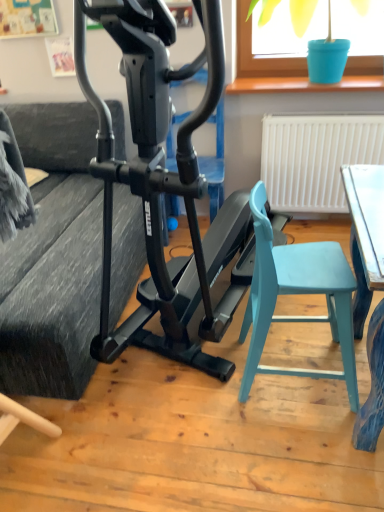
Question: Is black matte stationary bicycle at center smaller than textured gray couch at left?

Choices:
 (A) yes
 (B) no

Answer: (A)

Question: Is black matte stationary bicycle at center bigger than textured gray couch at left?

Choices:
 (A) no
 (B) yes

Answer: (A)

Question: Is black matte stationary bicycle at center not inside textured gray couch at left?

Choices:
 (A) yes
 (B) no

Answer: (A)

Question: Is black matte stationary bicycle at center shorter than textured gray couch at left?

Choices:
 (A) no
 (B) yes

Answer: (A)

Question: Is the depth of black matte stationary bicycle at center less than that of textured gray couch at left?

Choices:
 (A) yes
 (B) no

Answer: (A)

Question: Does black matte stationary bicycle at center touch textured gray couch at left?

Choices:
 (A) yes
 (B) no

Answer: (B)

Question: Can you see blue plastic bucket at upper right touching black matte stationary bicycle at center?

Choices:
 (A) no
 (B) yes

Answer: (A)

Question: Is blue plastic bucket at upper right at the right side of black matte stationary bicycle at center?

Choices:
 (A) no
 (B) yes

Answer: (B)

Question: Is blue plastic bucket at upper right facing away from black matte stationary bicycle at center?

Choices:
 (A) no
 (B) yes

Answer: (A)

Question: Considering the relative sizes of blue plastic bucket at upper right and black matte stationary bicycle at center in the image provided, is blue plastic bucket at upper right shorter than black matte stationary bicycle at center?

Choices:
 (A) no
 (B) yes

Answer: (B)

Question: From the image's perspective, does blue plastic bucket at upper right appear lower than black matte stationary bicycle at center?

Choices:
 (A) no
 (B) yes

Answer: (A)

Question: Can you confirm if blue plastic bucket at upper right is smaller than black matte stationary bicycle at center?

Choices:
 (A) no
 (B) yes

Answer: (B)

Question: Would you say black matte stationary bicycle at center is part of light blue plastic chair at lower right's contents?

Choices:
 (A) yes
 (B) no

Answer: (B)